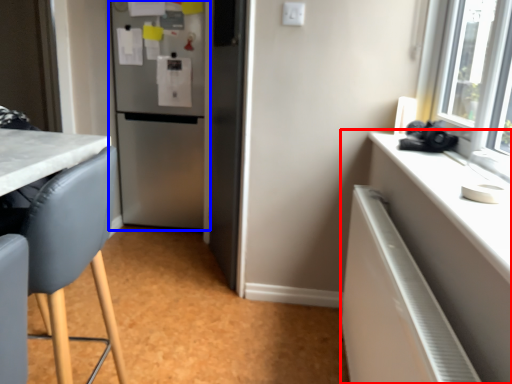
Question: Which object is further to the camera taking this photo, cabinetry (highlighted by a red box) or refrigerator (highlighted by a blue box)?

Choices:
 (A) cabinetry
 (B) refrigerator

Answer: (B)